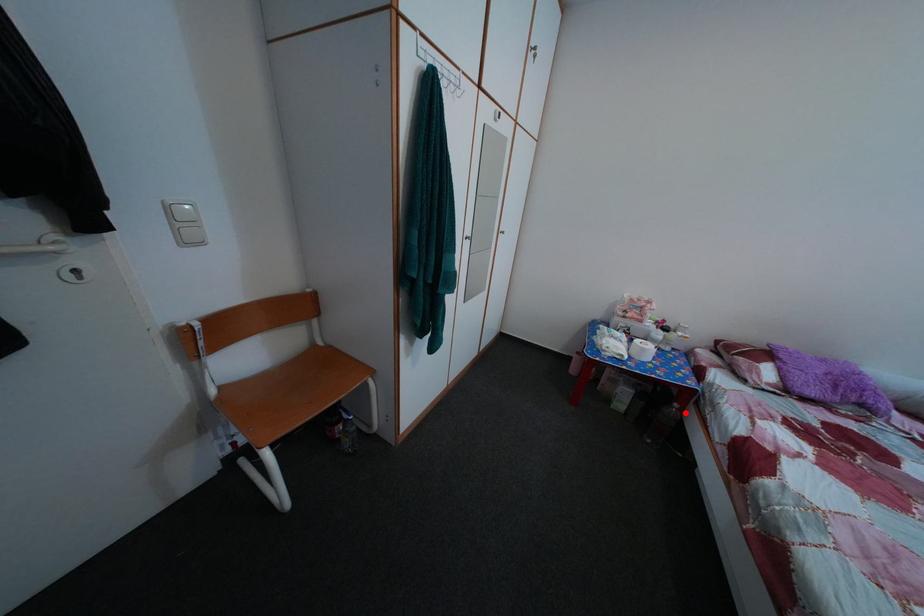
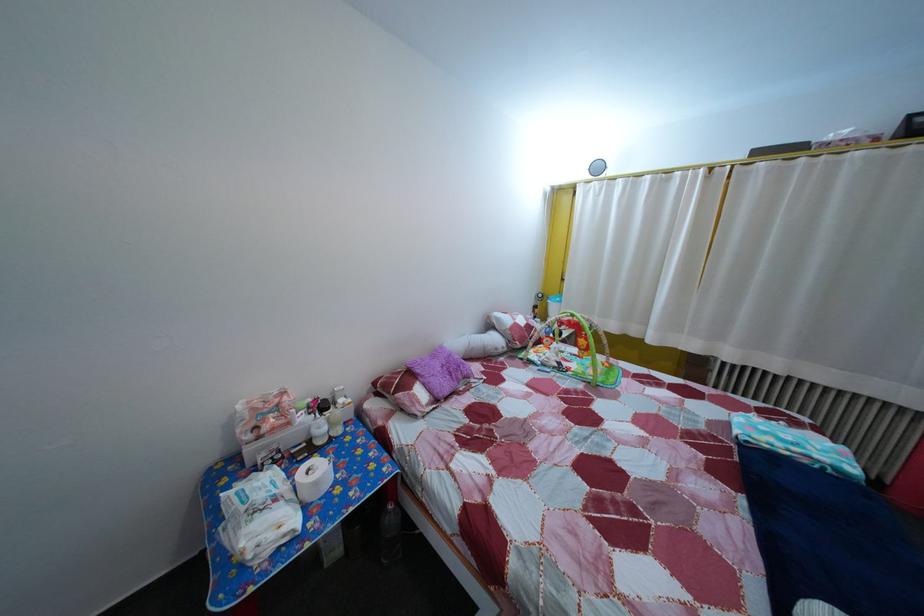
Question: I am providing you with two images of the same scene from different viewpoints. Given a red point in image1, look at the same physical point in image2. Is it:

Choices:
 (A) Closer to the viewpoint
 (B) Farther from the viewpoint

Answer: (B)